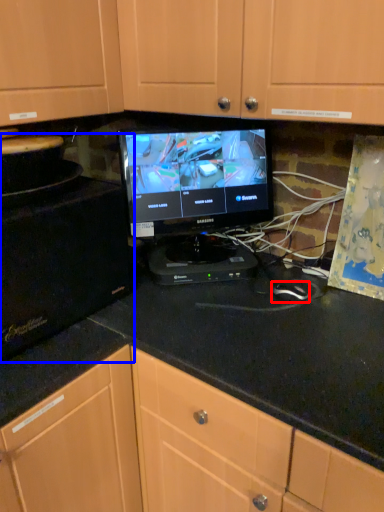
Question: Which object is closer to the camera taking this photo, mouse (highlighted by a red box) or appliance (highlighted by a blue box)?

Choices:
 (A) mouse
 (B) appliance

Answer: (B)